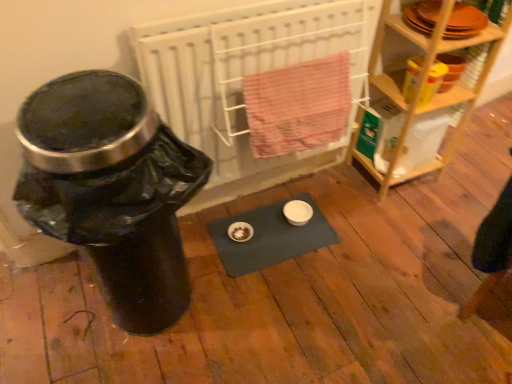
Where is `free point behind blue fabric yoga mat at center`? free point behind blue fabric yoga mat at center is located at coordinates (279, 186).